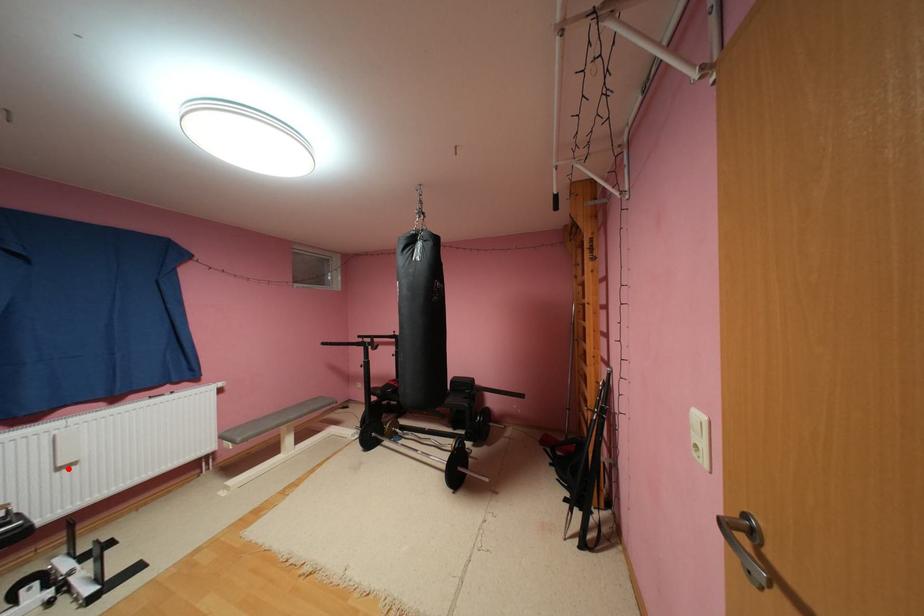
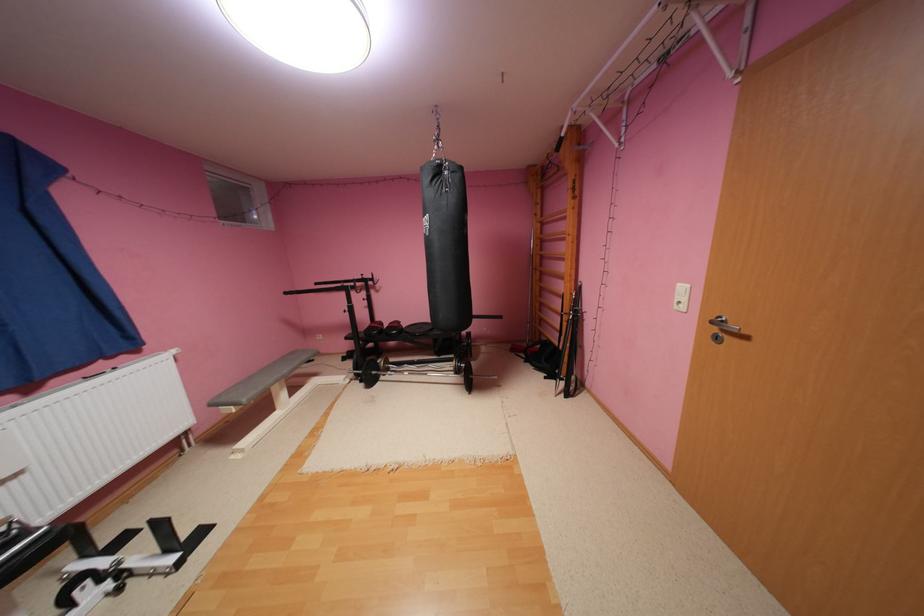
Question: I am providing you with two images of the same scene from different viewpoints. Given a red point in image1, look at the same physical point in image2. Is it:

Choices:
 (A) Closer to the viewpoint
 (B) Farther from the viewpoint

Answer: (B)